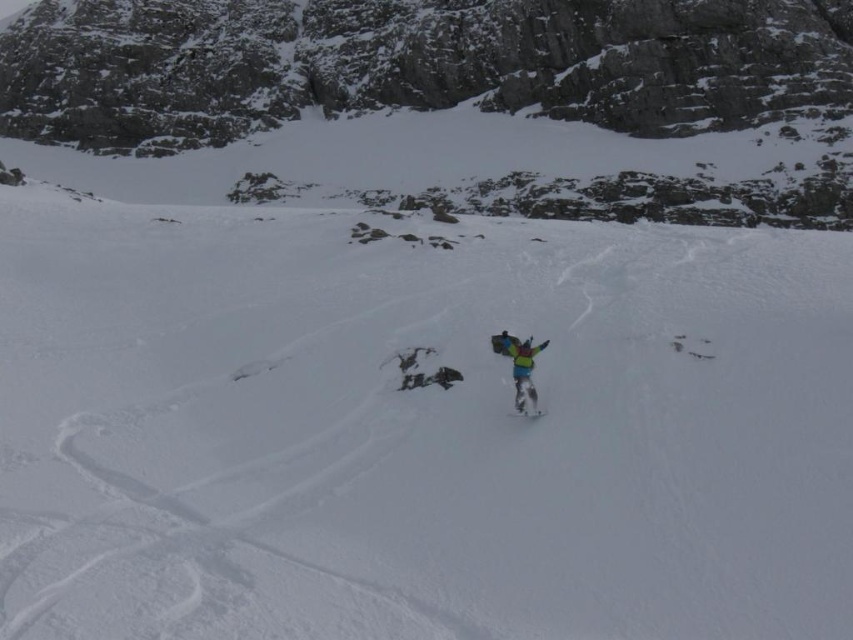
Is point (534, 38) positioned after point (535, 416)?

Yes, point (534, 38) is farther from viewer.

Does rocky gray mountain at center have a larger size compared to white matte snowboard at center?

Correct, rocky gray mountain at center is larger in size than white matte snowboard at center.

Identify the location of rocky gray mountain at center. (412, 65).

Where is `rocky gray mountain at center`? This screenshot has height=640, width=853. rocky gray mountain at center is located at coordinates (412, 65).

Is white matte snow at center further to the viewer compared to rocky gray mountain at center?

No, it is not.

I want to click on white matte snow at center, so click(x=416, y=429).

You are a GUI agent. You are given a task and a screenshot of the screen. Output one action in this format:
    pyautogui.click(x=<x>, y=<y>)
    Task: Click on the white matte snow at center
    This screenshot has height=640, width=853.
    Given the screenshot: What is the action you would take?
    pyautogui.click(x=416, y=429)

Does rocky gray mountain at center appear under multicolored fabric snowboarder at center?

Actually, rocky gray mountain at center is above multicolored fabric snowboarder at center.

The height and width of the screenshot is (640, 853). What do you see at coordinates (412, 65) in the screenshot?
I see `rocky gray mountain at center` at bounding box center [412, 65].

This screenshot has width=853, height=640. What are the coordinates of `rocky gray mountain at center` in the screenshot? It's located at (x=412, y=65).

Locate an element on the screen. rocky gray mountain at center is located at coordinates (412, 65).